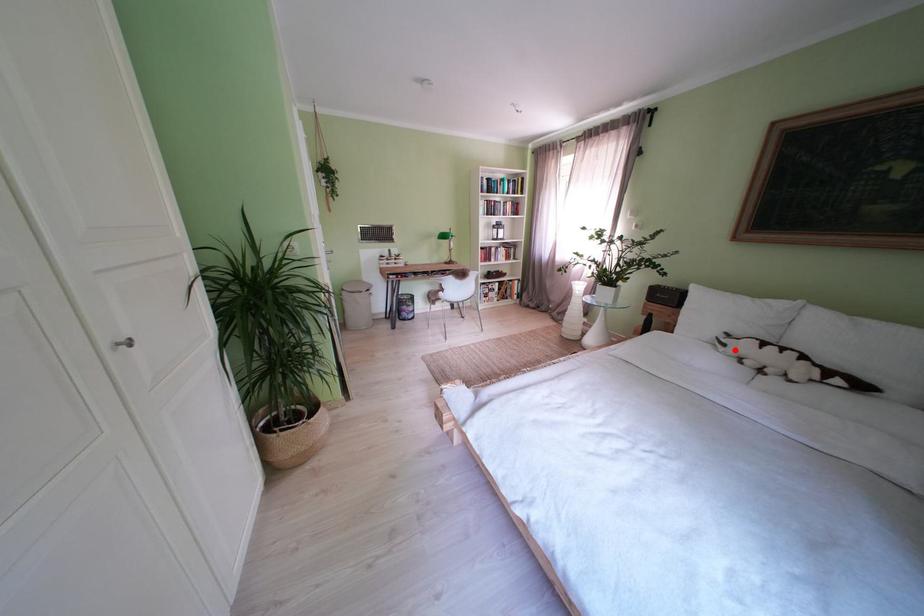
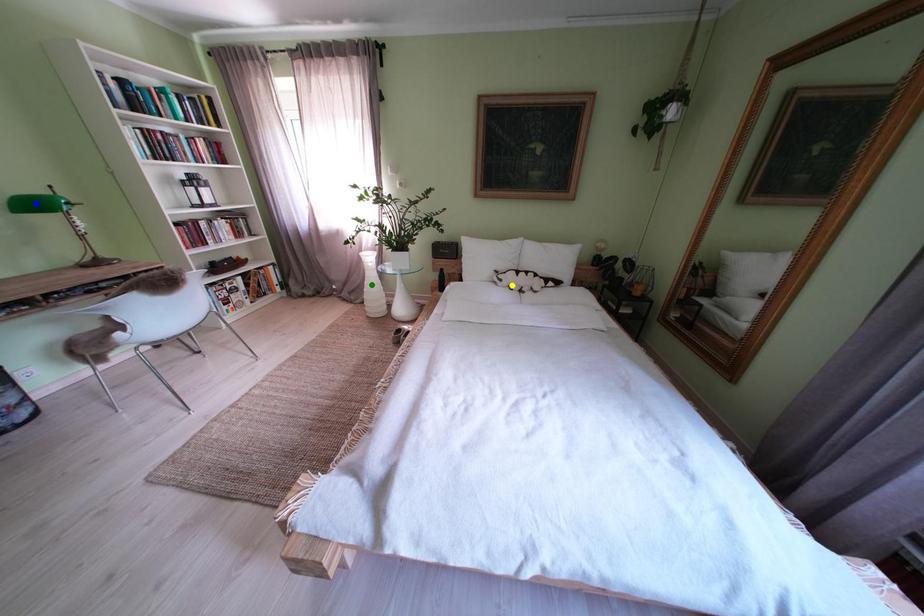
Question: I am providing you with two images of the same scene from different viewpoints. A red point is marked on the first image. You are given multiple points on the second image. Which spot in image 2 lines up with the point in image 1?

Choices:
 (A) yellow point
 (B) blue point
 (C) green point

Answer: (A)